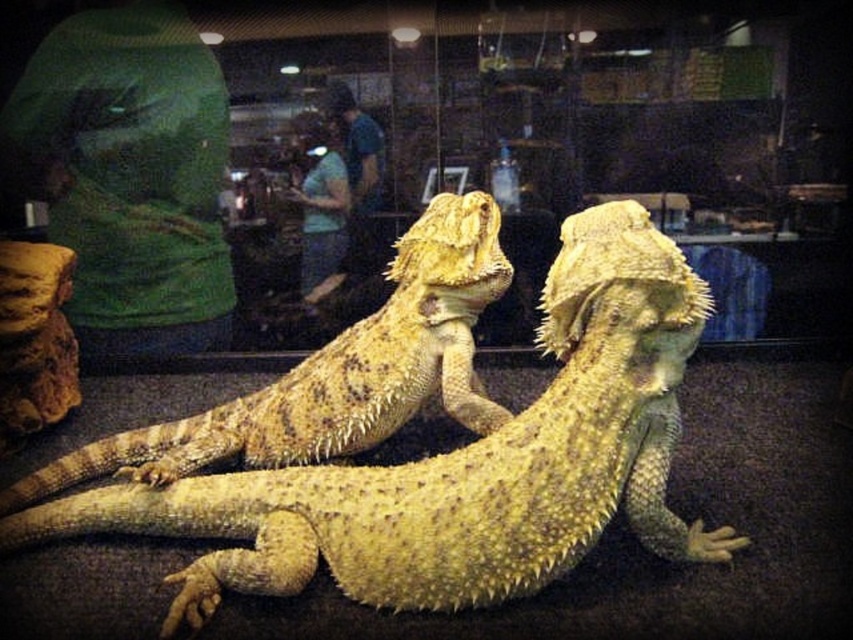
Question: Can you confirm if yellow scaly lizard at center is positioned to the left of yellow spiny lizard at center?

Choices:
 (A) no
 (B) yes

Answer: (A)

Question: Which point is farther from the camera taking this photo?

Choices:
 (A) (450, 349)
 (B) (305, 524)

Answer: (A)

Question: Which object is closer to the camera taking this photo?

Choices:
 (A) yellow scaly lizard at center
 (B) yellow spiny lizard at center

Answer: (A)

Question: Which object appears closest to the camera in this image?

Choices:
 (A) yellow scaly lizard at center
 (B) yellow spiny lizard at center

Answer: (A)

Question: Observing the image, what is the correct spatial positioning of yellow scaly lizard at center in reference to yellow spiny lizard at center?

Choices:
 (A) below
 (B) above

Answer: (A)

Question: Can you confirm if yellow scaly lizard at center is positioned below yellow spiny lizard at center?

Choices:
 (A) no
 (B) yes

Answer: (B)